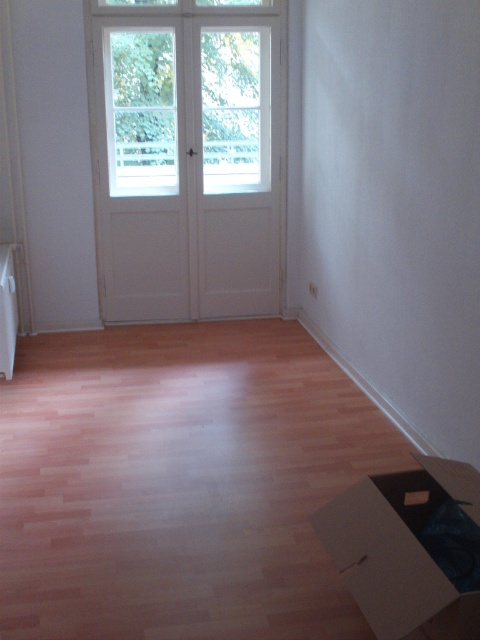
Question: Can you confirm if white wooden door at upper center is positioned above brown cardboard box at lower right?

Choices:
 (A) no
 (B) yes

Answer: (B)

Question: Which point appears closest to the camera in this image?

Choices:
 (A) (194, 145)
 (B) (395, 508)

Answer: (B)

Question: Does white wooden door at upper center appear on the left side of brown cardboard box at lower right?

Choices:
 (A) yes
 (B) no

Answer: (A)

Question: Is white wooden door at upper center below brown cardboard box at lower right?

Choices:
 (A) no
 (B) yes

Answer: (A)